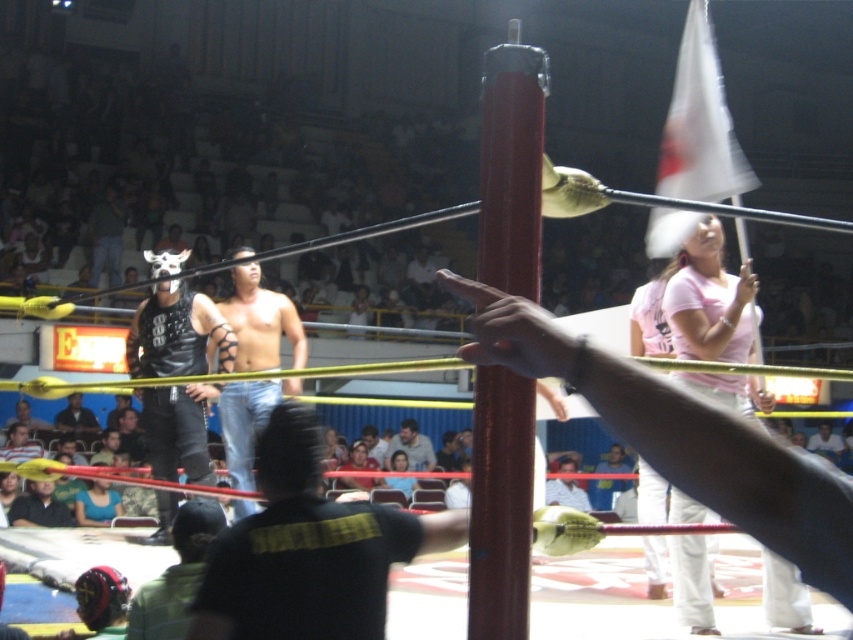
Question: Which of these objects is positioned closest to the white fabric shirt at center?

Choices:
 (A) black leather jacket at center
 (B) shiny red pole at center
 (C) beige fabric shirt at center
 (D) shiny black leather pants at center

Answer: (C)

Question: Does black leather jacket at center have a smaller size compared to shiny red pole at center?

Choices:
 (A) no
 (B) yes

Answer: (A)

Question: Which object appears closest to the camera in this image?

Choices:
 (A) black leather mask at left
 (B) beige fabric shirt at center

Answer: (A)

Question: Which of these objects is positioned farthest from the white fabric shirt at center?

Choices:
 (A) dark blue shirt at lower left
 (B) black leather jacket at center

Answer: (B)

Question: Does shiny red pole at center have a lesser width compared to white fabric shirt at center?

Choices:
 (A) no
 (B) yes

Answer: (B)

Question: Is shiny black leather pants at center closer to camera compared to beige fabric shirt at center?

Choices:
 (A) no
 (B) yes

Answer: (B)